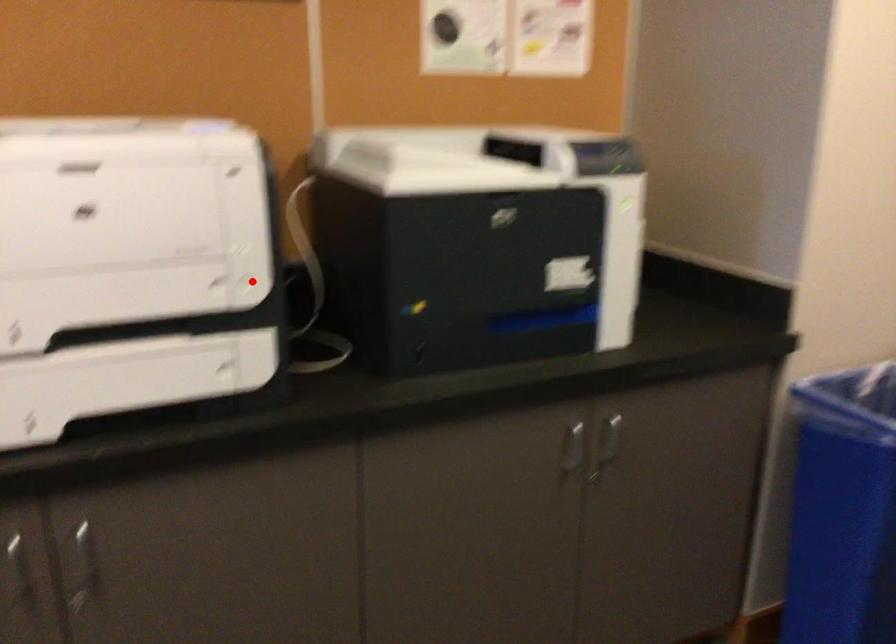
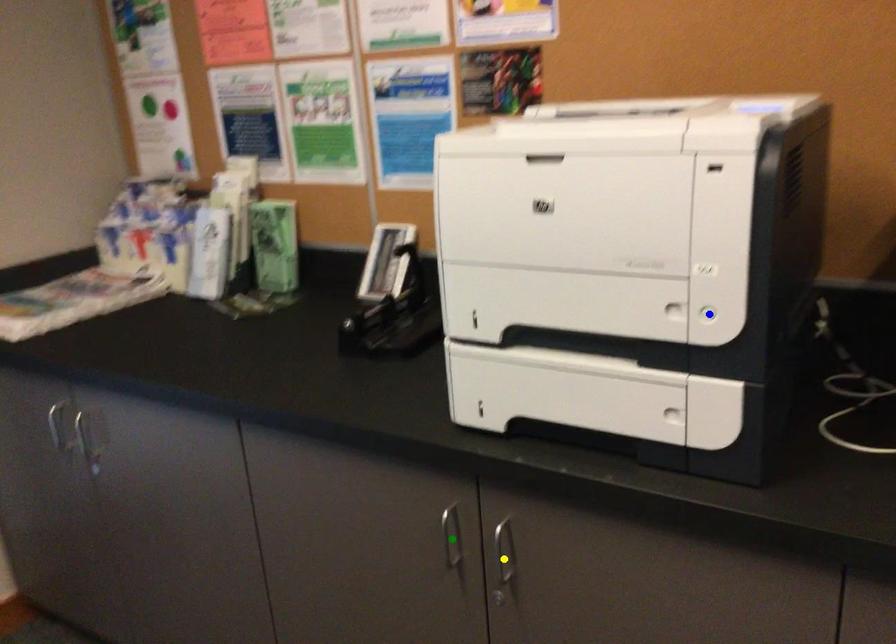
Question: I am providing you with two images of the same scene from different viewpoints. A red point is marked on the first image. You are given multiple points on the second image. Which point in image 2 represents the same 3d spot as the red point in image 1?

Choices:
 (A) blue point
 (B) green point
 (C) yellow point

Answer: (A)